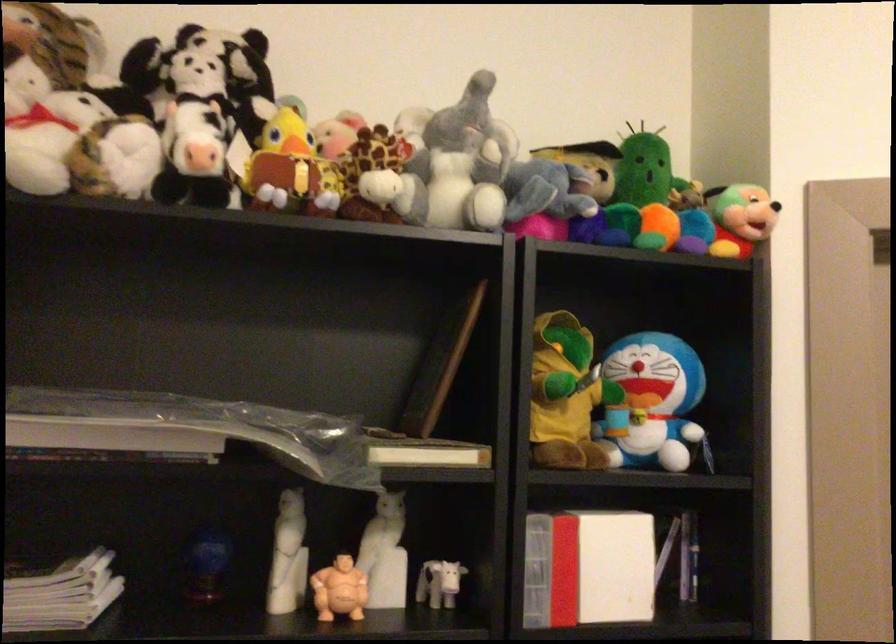
Where is `stuffed elephant toy`? The width and height of the screenshot is (896, 644). stuffed elephant toy is located at coordinates (459, 165).